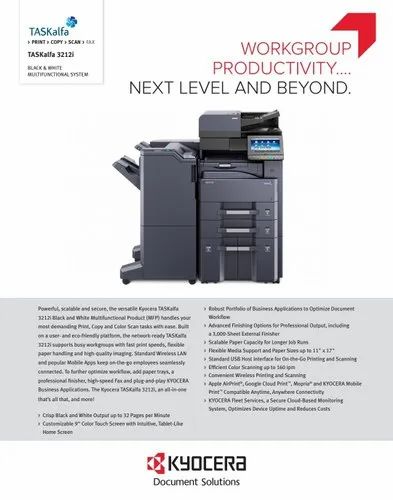
The height and width of the screenshot is (500, 393). Identify the location of paper tray. (234, 209), (239, 230), (242, 247).